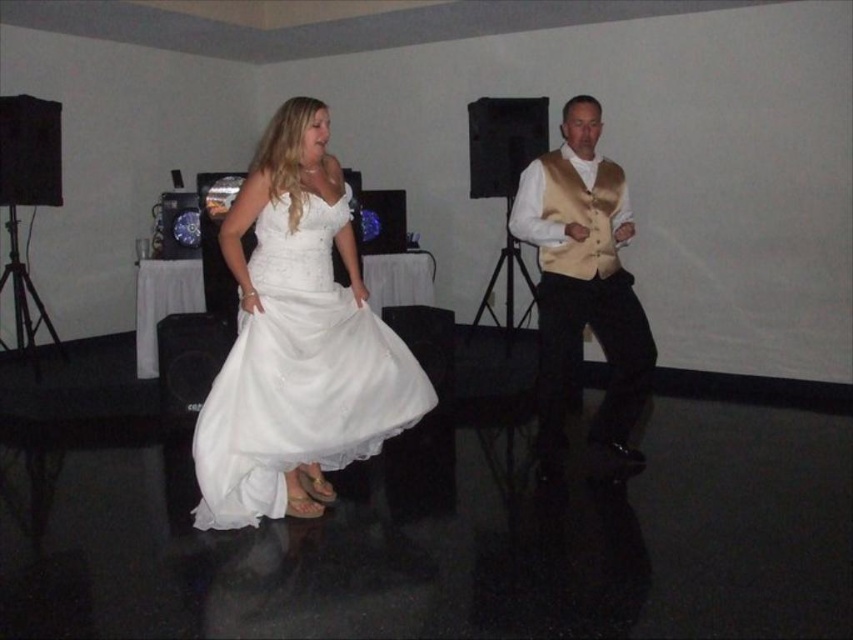
You are a photographer at a wedding reception. You need to capture a closeup shot of both the white satin dress at center and the shiny gold vest at center. Given that your camera can only focus on one object at a time, which object should you focus on first to ensure the smaller one is in focus?

The white satin dress at center is smaller than the shiny gold vest at center, so you should focus on the white satin dress at center first to ensure it is in focus before adjusting for the larger shiny gold vest at center.

You are a photographer at a wedding reception. You want to capture a photo of the white satin dress at center and the shiny gold vest at center. The camera you are using has a minimum focus distance of 1 meter. Can you take a photo of both subjects without moving either of them?

The distance between the white satin dress at center and the shiny gold vest at center is 1.06 meters. Since the camera requires a minimum focus distance of 1 meter, the photographer can take the photo as the distance is sufficient.